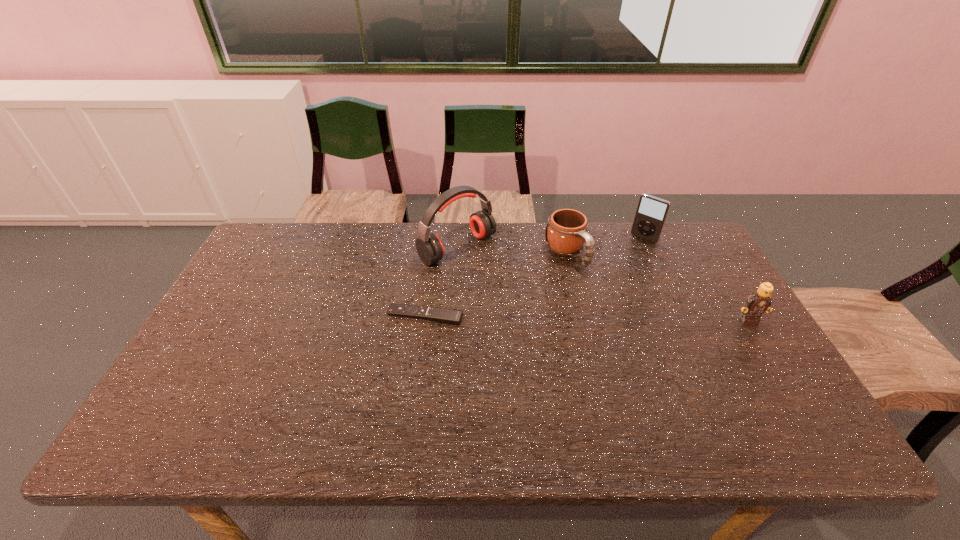
Identify the location of the second closest object relative to the mug. The image size is (960, 540). (651, 213).

I want to click on vacant region that satisfies the following two spatial constraints: 1. on the back side of the remote control; 2. on the right side of the second object from right to left, so click(435, 238).

The image size is (960, 540). Find the location of `vacant space that satisfies the following two spatial constraints: 1. on the front side of the mug; 2. on the left side of the earphone`. vacant space that satisfies the following two spatial constraints: 1. on the front side of the mug; 2. on the left side of the earphone is located at coordinates (457, 253).

I want to click on free space that satisfies the following two spatial constraints: 1. on the back side of the third object from right to left; 2. on the left side of the shortest object, so click(x=433, y=253).

Locate an element on the screen. The width and height of the screenshot is (960, 540). free spot that satisfies the following two spatial constraints: 1. on the back side of the mug; 2. on the left side of the iPod is located at coordinates (562, 238).